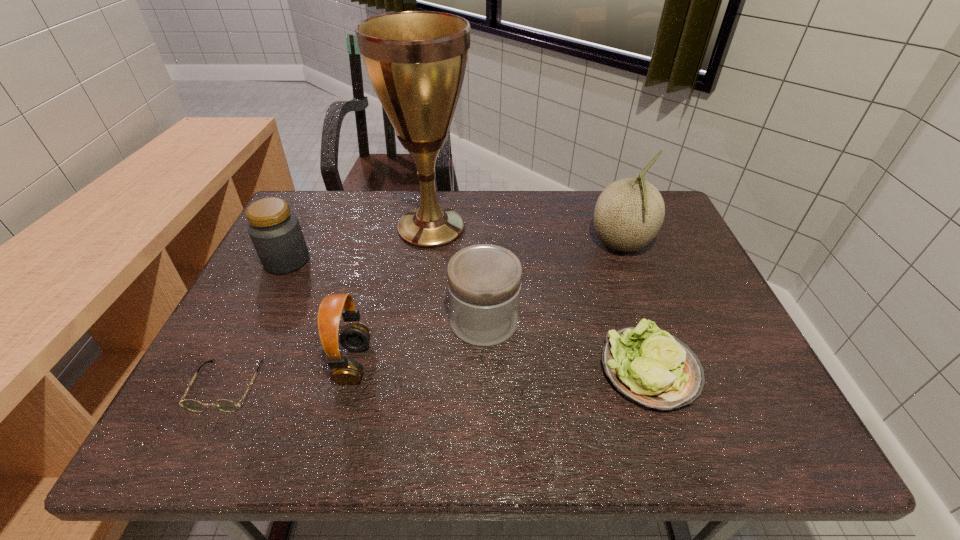
Where is `cantaloup that is at the right edge`? This screenshot has width=960, height=540. cantaloup that is at the right edge is located at coordinates 629,213.

The width and height of the screenshot is (960, 540). I want to click on lettuce that is at the right edge, so click(649, 366).

The width and height of the screenshot is (960, 540). I want to click on object positioned at the near left corner, so click(225, 405).

The height and width of the screenshot is (540, 960). I want to click on object that is at the far right corner, so click(629, 213).

Find the location of `object situated at the near right corner`. object situated at the near right corner is located at coordinates (649, 366).

Find the location of `vacant space at the far edge`. vacant space at the far edge is located at coordinates (534, 208).

In the image, there is a desktop. Identify the location of free region at the near edge. This screenshot has height=540, width=960. (300, 417).

Find the location of a particular element. The height and width of the screenshot is (540, 960). vacant space at the left edge of the desktop is located at coordinates (261, 326).

Locate an element on the screen. vacant space at the right edge of the desktop is located at coordinates (736, 354).

At what (x,y) coordinates should I click in order to perform the action: click on vacant space at the far left corner. Please return your answer as a coordinate pair (x, y). Looking at the image, I should click on (327, 192).